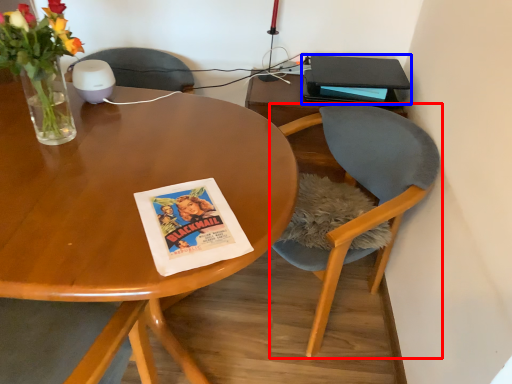
Question: Which of the following is the farthest to the observer, chair (highlighted by a red box) or paperback book (highlighted by a blue box)?

Choices:
 (A) chair
 (B) paperback book

Answer: (B)